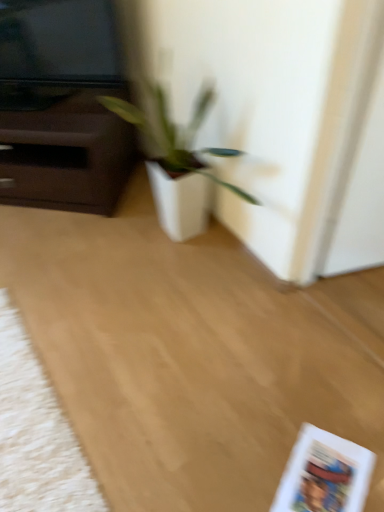
Locate an element on the screen. This screenshot has width=384, height=512. vacant space underneath white matte pot at center (from a real-world perspective) is located at coordinates pos(189,258).